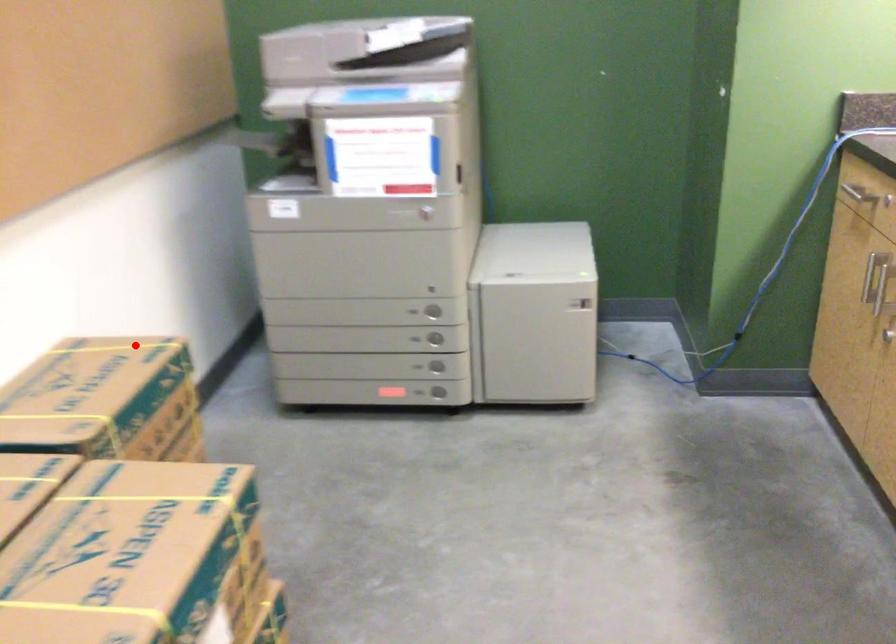
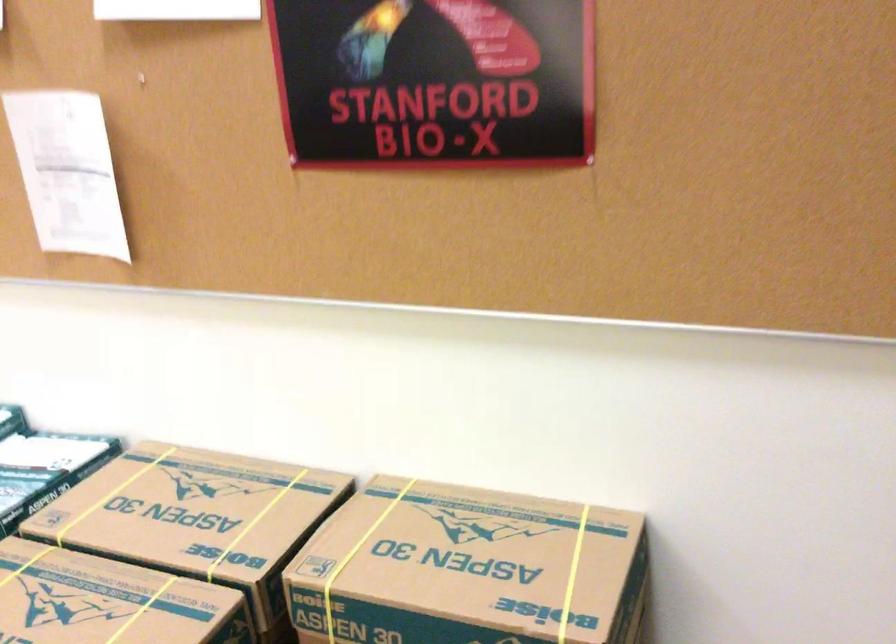
Question: I am providing you with two images of the same scene from different viewpoints. Given a red point in image1, look at the same physical point in image2. Is it:

Choices:
 (A) Closer to the viewpoint
 (B) Farther from the viewpoint

Answer: (A)